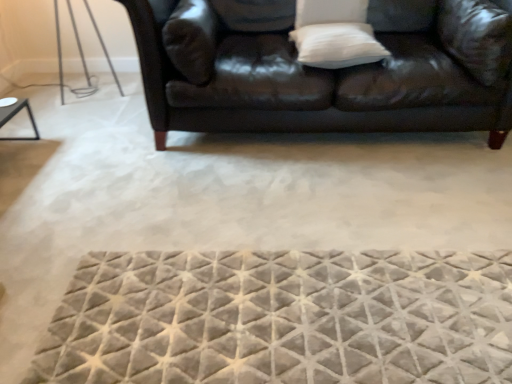
Question: From the image's perspective, is textured gray mat at center under white soft pillow at upper right, the first pillow in the right-to-left sequence?

Choices:
 (A) yes
 (B) no

Answer: (A)

Question: Can you confirm if textured gray mat at center is taller than white soft pillow at upper right, the first pillow in the right-to-left sequence?

Choices:
 (A) yes
 (B) no

Answer: (B)

Question: Considering the relative sizes of textured gray mat at center and white soft pillow at upper right, the first pillow in the right-to-left sequence, in the image provided, is textured gray mat at center smaller than white soft pillow at upper right, the first pillow in the right-to-left sequence,?

Choices:
 (A) yes
 (B) no

Answer: (A)

Question: Can you confirm if textured gray mat at center is positioned to the left of white soft pillow at upper right, marked as the 3th pillow in a left-to-right arrangement?

Choices:
 (A) yes
 (B) no

Answer: (A)

Question: Considering the relative sizes of textured gray mat at center and white soft pillow at upper right, the first pillow in the right-to-left sequence, in the image provided, is textured gray mat at center wider than white soft pillow at upper right, the first pillow in the right-to-left sequence,?

Choices:
 (A) no
 (B) yes

Answer: (B)

Question: From a real-world perspective, is textured gray mat at center positioned above or below leather couch at upper center?

Choices:
 (A) above
 (B) below

Answer: (B)

Question: Looking at their shapes, would you say textured gray mat at center is wider or thinner than leather couch at upper center?

Choices:
 (A) wide
 (B) thin

Answer: (B)

Question: From their relative heights in the image, would you say textured gray mat at center is taller or shorter than leather couch at upper center?

Choices:
 (A) tall
 (B) short

Answer: (B)

Question: From the image's perspective, is textured gray mat at center above or below leather couch at upper center?

Choices:
 (A) above
 (B) below

Answer: (B)

Question: Considering the positions of point (333, 259) and point (451, 8), is point (333, 259) closer or farther from the camera than point (451, 8)?

Choices:
 (A) closer
 (B) farther

Answer: (A)

Question: Considering their positions, is textured gray mat at center located in front of or behind white soft pillow at upper right, the first pillow in the right-to-left sequence?

Choices:
 (A) behind
 (B) front

Answer: (B)

Question: Is textured gray mat at center bigger or smaller than white soft pillow at upper right, marked as the 3th pillow in a left-to-right arrangement?

Choices:
 (A) big
 (B) small

Answer: (B)

Question: Considering the positions of textured gray mat at center and white soft pillow at upper right, the first pillow in the right-to-left sequence, in the image, is textured gray mat at center wider or thinner than white soft pillow at upper right, the first pillow in the right-to-left sequence,?

Choices:
 (A) thin
 (B) wide

Answer: (B)

Question: Relative to textured gray mat at center, is white soft pillow at upper center, which is the 3th pillow in right-to-left order, in front or behind?

Choices:
 (A) front
 (B) behind

Answer: (B)

Question: Is white soft pillow at upper center, arranged as the first pillow when viewed from the left, taller or shorter than textured gray mat at center?

Choices:
 (A) tall
 (B) short

Answer: (A)